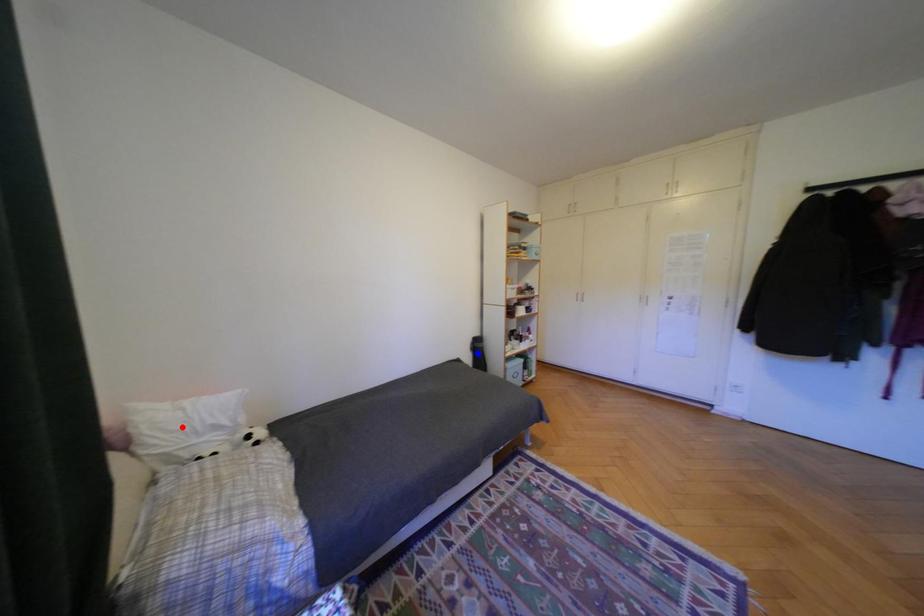
Question: Two points are marked on the image. Which point is closer to the camera?

Choices:
 (A) Blue point is closer.
 (B) Red point is closer.

Answer: (B)